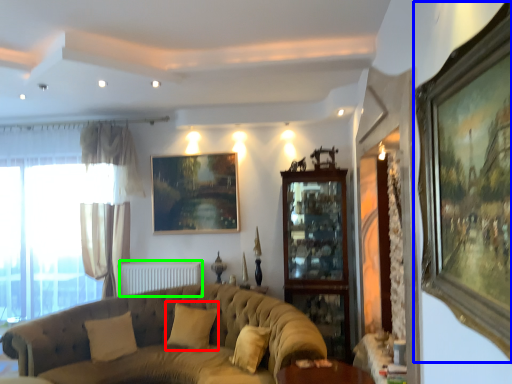
Question: Estimate the real-world distances between objects in this image. Which object is closer to pillow (highlighted by a red box), picture frame (highlighted by a blue box) or radiator (highlighted by a green box)?

Choices:
 (A) picture frame
 (B) radiator

Answer: (B)